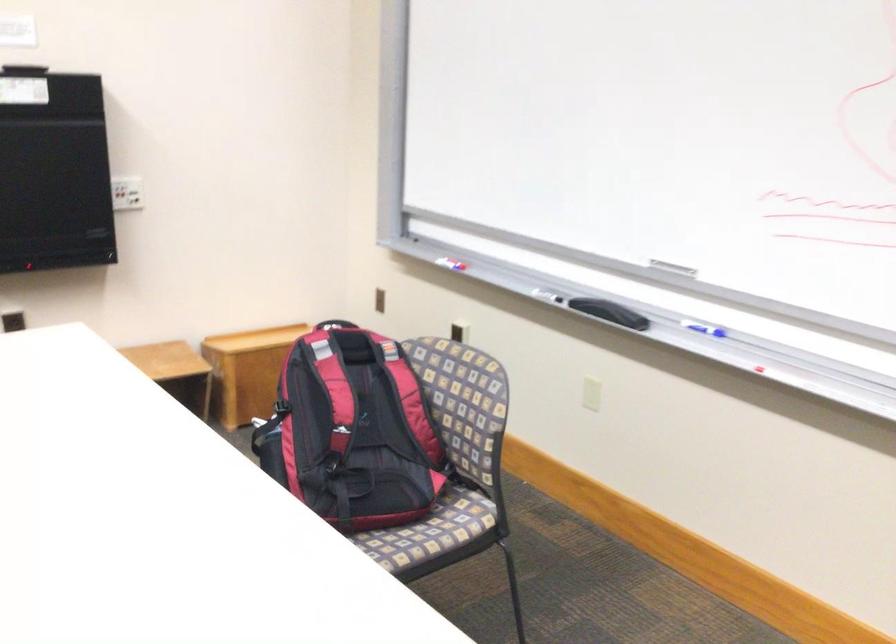
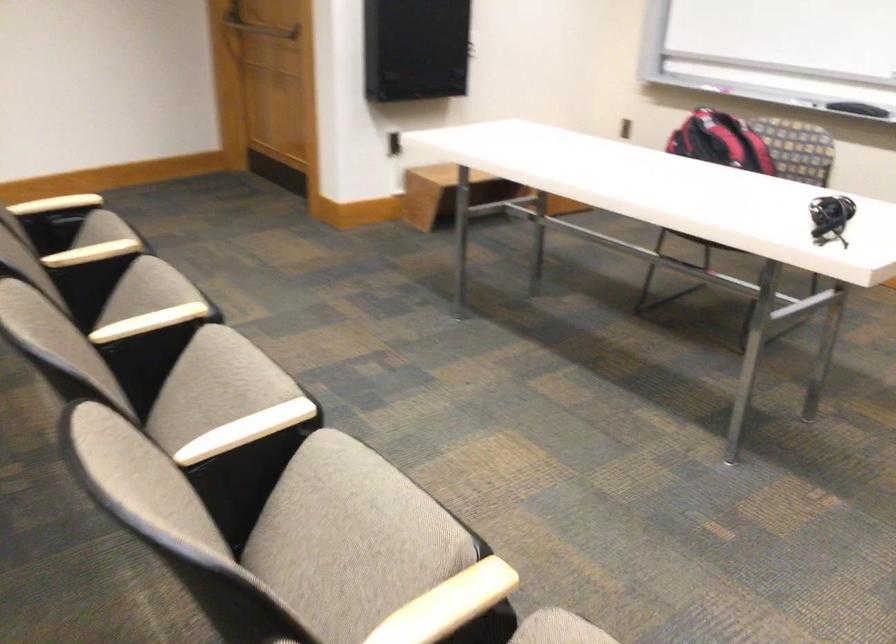
Question: I am providing you with two images of the same scene from different viewpoints. After the viewpoint changes to image2, which objects are now occluded?

Choices:
 (A) door push bar
 (B) chair armrest
 (C) small black device
 (D) none of these

Answer: (D)